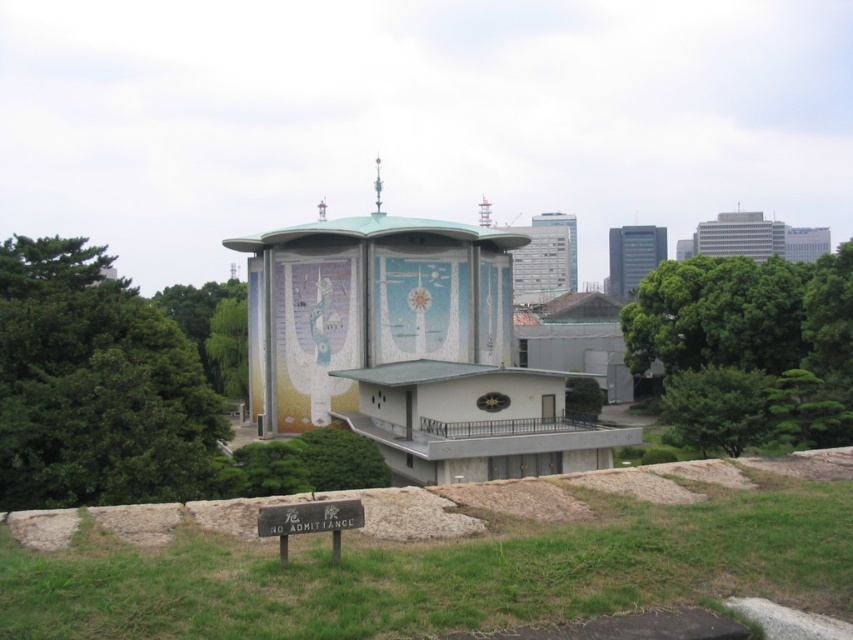
Can you confirm if green leafy tree at right is positioned below smooth concrete tower at center?

Yes.

Is green leafy tree at right shorter than smooth concrete tower at center?

Correct, green leafy tree at right is not as tall as smooth concrete tower at center.

Does point (775, 332) come farther from viewer compared to point (570, 280)?

No.

Locate an element on the screen. green leafy tree at right is located at coordinates (747, 348).

Who is shorter, green leafy tree at right or smooth glass skyscraper at upper center?

Standing shorter between the two is green leafy tree at right.

Which is above, green leafy tree at right or smooth glass skyscraper at upper center?

smooth glass skyscraper at upper center

The height and width of the screenshot is (640, 853). What do you see at coordinates (747, 348) in the screenshot? I see `green leafy tree at right` at bounding box center [747, 348].

This screenshot has height=640, width=853. What are the coordinates of `green leafy tree at right` in the screenshot? It's located at (747, 348).

Which is more to the left, smooth glass skyscraper at upper right or smooth glass skyscraper at upper center?

From the viewer's perspective, smooth glass skyscraper at upper center appears more on the left side.

Who is more distant from viewer, (635, 253) or (556, 221)?

The point (635, 253) is more distant.

At what (x,y) coordinates should I click in order to perform the action: click on smooth glass skyscraper at upper right. Please return your answer as a coordinate pair (x, y). Image resolution: width=853 pixels, height=640 pixels. Looking at the image, I should click on (631, 257).